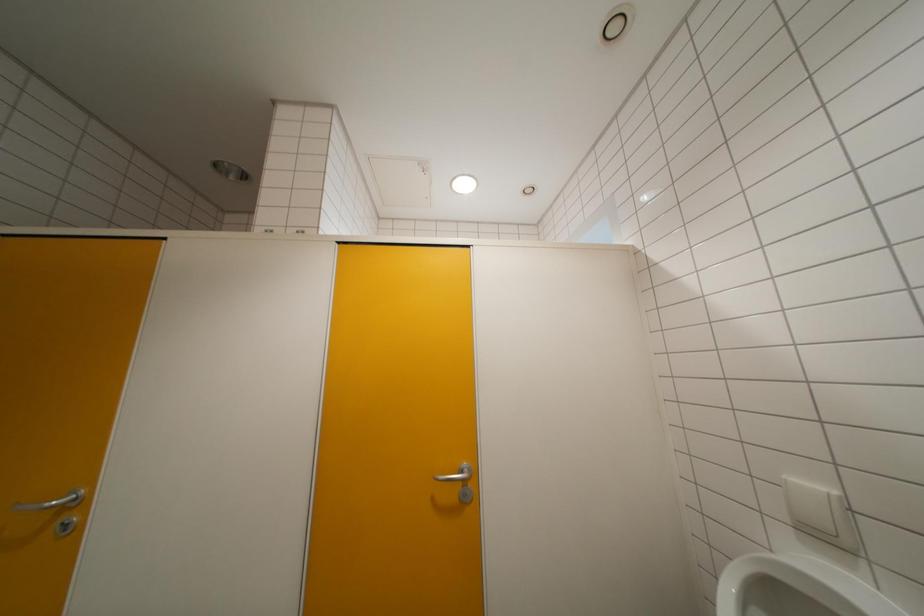
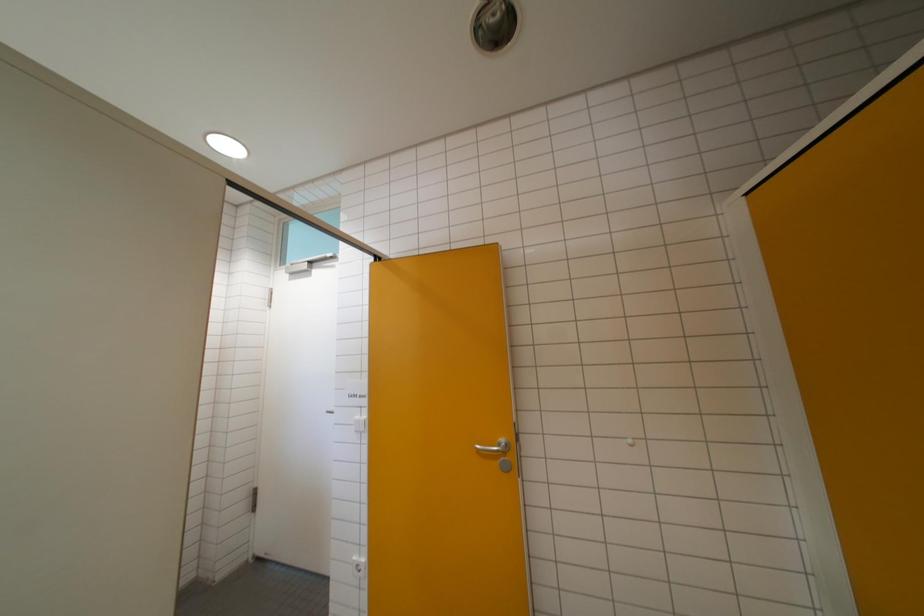
Question: The images are taken continuously from a first-person perspective. In which direction is your viewpoint rotating?

Choices:
 (A) Left
 (B) Right
 (C) Up
 (D) Down

Answer: (A)